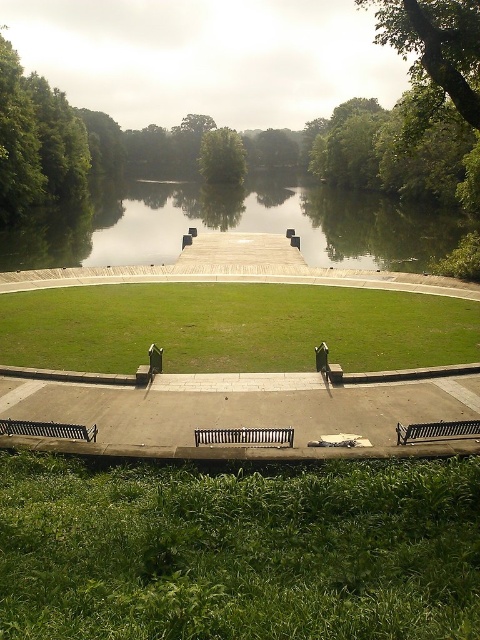
You are planning to place a new flower bed between the green reflective water at center and the black metal bench at lower left. Based on their positions, which object should the flower bed be closer to?

The flower bed should be closer to the black metal bench at lower left because the green reflective water at center is positioned on the left side of the black metal bench at lower left, meaning the bench is to the right of the water. Therefore, placing the flower bed between them would require it to be nearer to the bench.

You are standing at the edge of the green grassy at lower center and want to walk towards the wooden dock extending into the water. Which direction should you head relative to the green leafy tree at center?

You should head to the right of the green leafy tree at center because the green grassy at lower center is located to the right of it, and the dock extends from that direction.